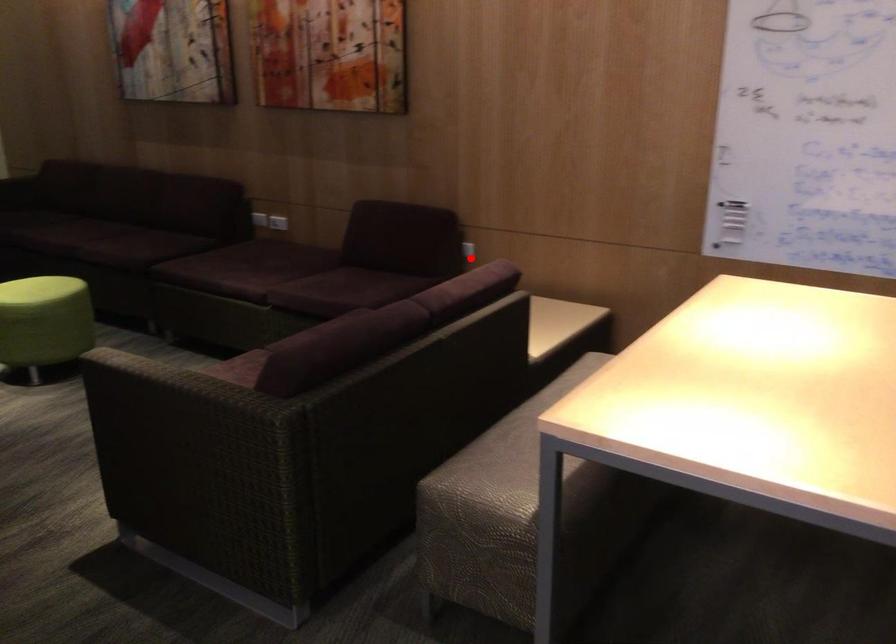
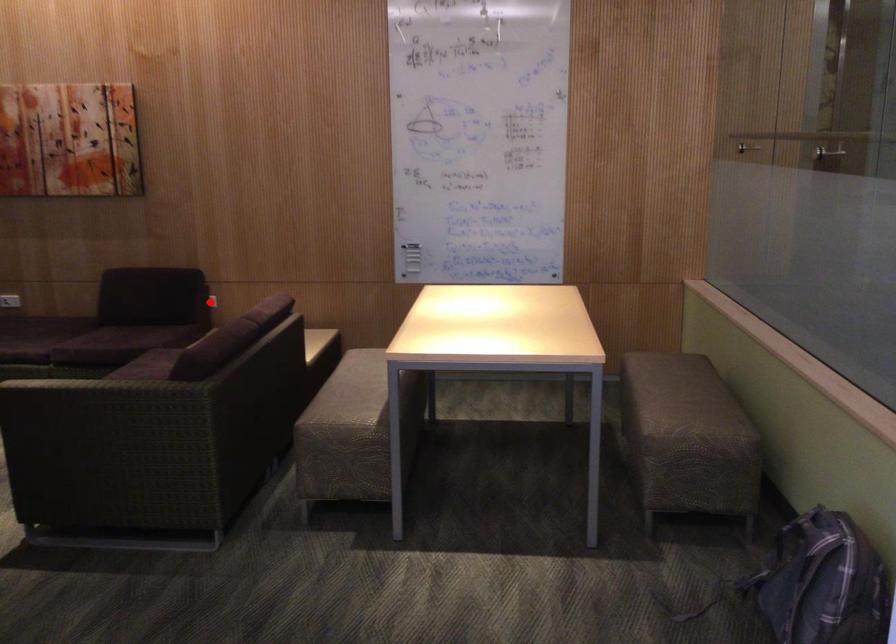
I am providing you with two images of the same scene from different viewpoints. A red point is marked on the first image and another point is marked on the second image. Does the point marked in image1 correspond to the same location as the one in image2?

Yes